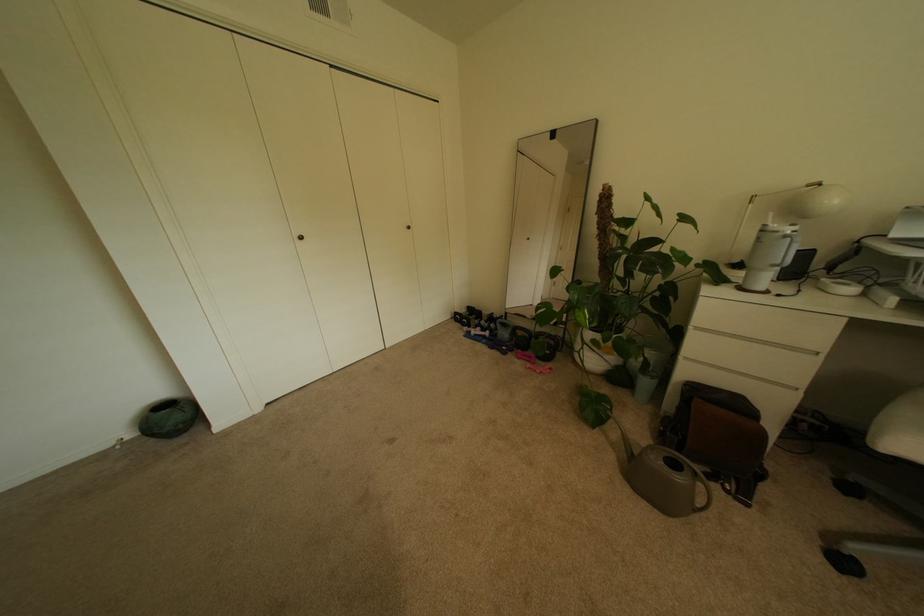
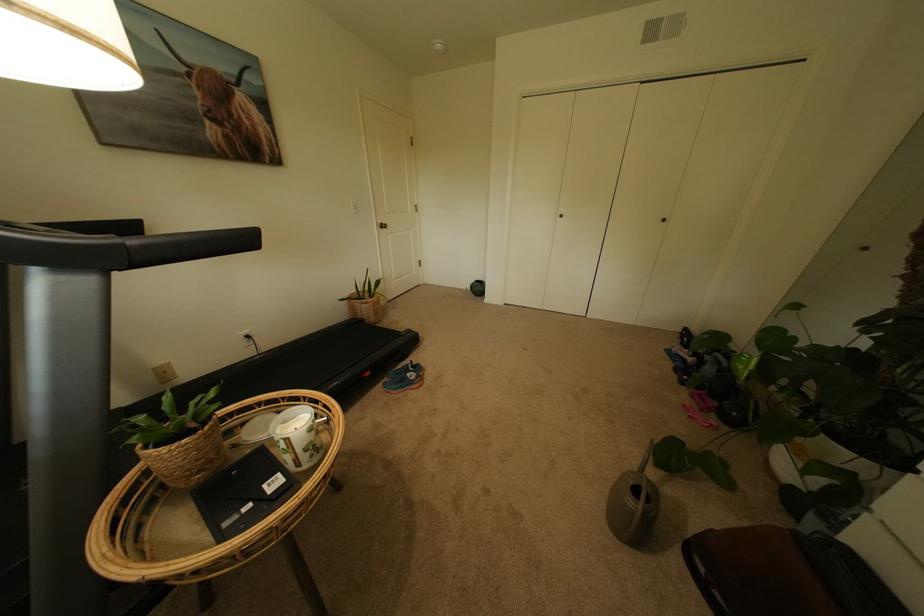
The point at (120, 445) is marked in the first image. Where is the corresponding point in the second image?

(473, 289)